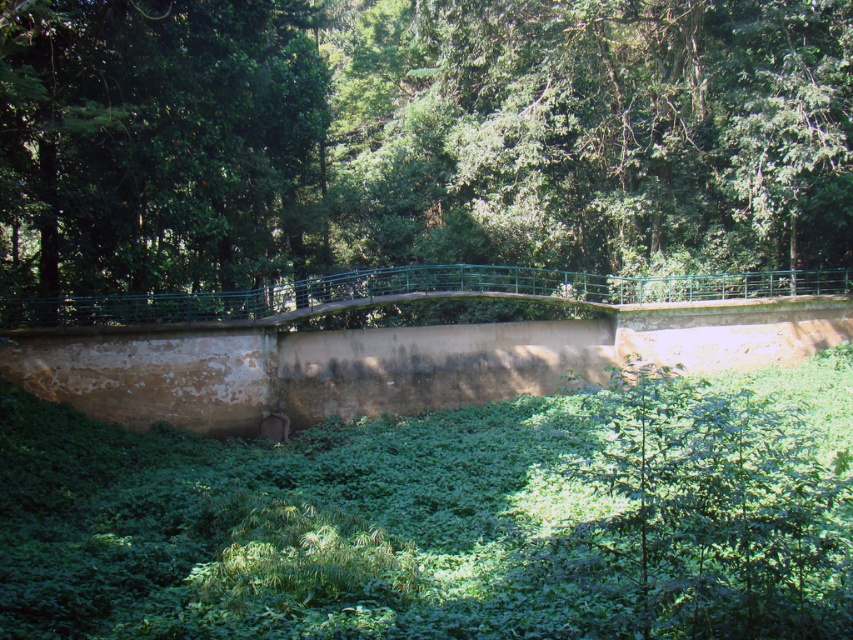
You are a hiker who wants to take a photo of the green leafy vegetation at center and the green leafy tree at center. Which one should you focus on if you want to capture the tallest object in the scene?

The green leafy tree at center is taller than the green leafy vegetation at center, so you should focus on the green leafy tree at center to capture the tallest object in the scene.

You are a bird flying over the scene and want to land on either the green metallic bridge at center or the green leafy vegetation at center. Which option allows you to land without hitting your wings on anything?

The green metallic bridge at center is taller than the green leafy vegetation at center, so landing on the green leafy vegetation at center would allow you to land without hitting your wings since it is shorter.